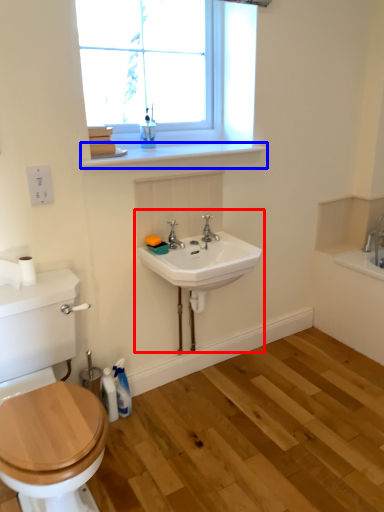
Question: Which object is closer to the camera taking this photo, sink (highlighted by a red box) or window sill (highlighted by a blue box)?

Choices:
 (A) sink
 (B) window sill

Answer: (A)